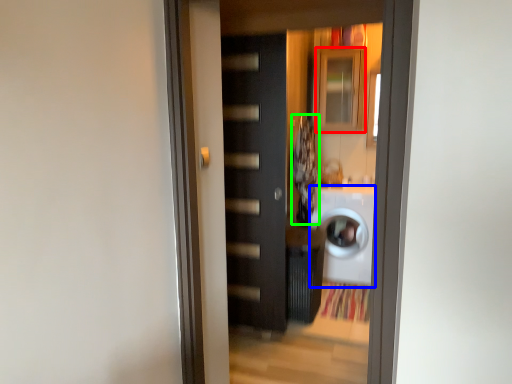
Question: Which object is the closest to the cabinetry (highlighted by a red box)? Choose among these: washing machine (highlighted by a blue box) or laundry (highlighted by a green box).

Choices:
 (A) washing machine
 (B) laundry

Answer: (B)